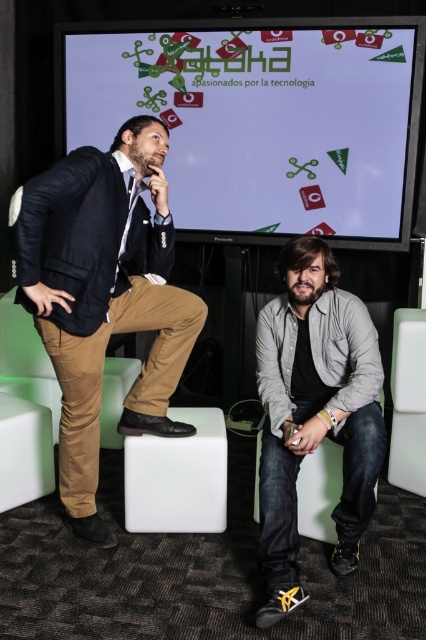
Is point (278, 92) closer to viewer compared to point (357, 358)?

No, (278, 92) is further to viewer.

Does white glossy screen at upper center have a greater height compared to gray cotton shirt at lower right?

Incorrect, white glossy screen at upper center's height is not larger of gray cotton shirt at lower right's.

Which is in front, point (307, 124) or point (316, 428)?

Point (316, 428) is more forward.

Locate an element on the screen. The width and height of the screenshot is (426, 640). white glossy screen at upper center is located at coordinates (264, 118).

Between dark blue suit at left and gray cotton shirt at lower right, which one is positioned higher?

dark blue suit at left is higher up.

Can you confirm if dark blue suit at left is positioned to the right of gray cotton shirt at lower right?

In fact, dark blue suit at left is to the left of gray cotton shirt at lower right.

Which is in front, point (115, 221) or point (267, 305)?

Point (115, 221)

Locate an element on the screen. dark blue suit at left is located at coordinates (103, 296).

Describe the element at coordinates (313, 412) in the screenshot. This screenshot has width=426, height=640. I see `gray cotton shirt at lower right` at that location.

Locate an element on the screen. The image size is (426, 640). gray cotton shirt at lower right is located at coordinates (313, 412).